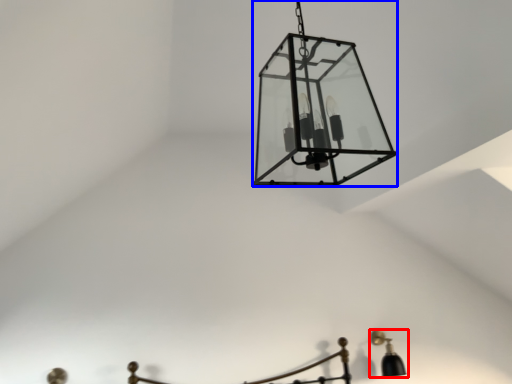
Question: Which point is further to the camera, lamp (highlighted by a red box) or lamp (highlighted by a blue box)?

Choices:
 (A) lamp
 (B) lamp

Answer: (A)